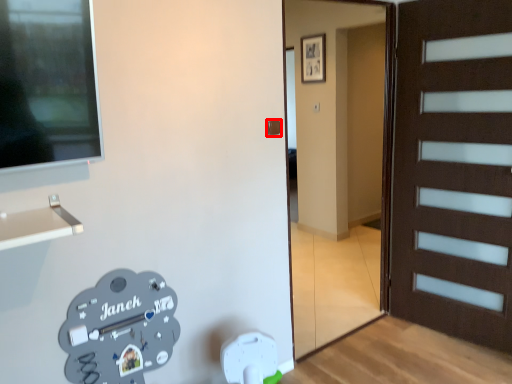
Question: From the image's perspective, where is door handle (annotated by the red box) located in relation to garage door in the image?

Choices:
 (A) above
 (B) below

Answer: (A)